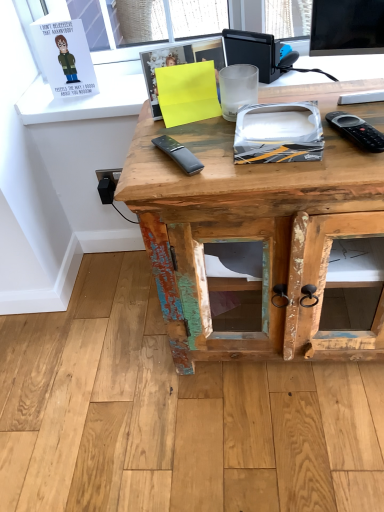
Question: Is rustic wood desk at center to the left of matte paper card at upper left, acting as the second book starting from the front, from the viewer's perspective?

Choices:
 (A) no
 (B) yes

Answer: (A)

Question: Is rustic wood desk at center not close to matte paper card at upper left, acting as the second book starting from the front?

Choices:
 (A) yes
 (B) no

Answer: (B)

Question: Would you say rustic wood desk at center is outside matte paper card at upper left, which is counted as the 1th book, starting from the top?

Choices:
 (A) no
 (B) yes

Answer: (B)

Question: Considering the relative sizes of rustic wood desk at center and matte paper card at upper left, the 1th book from the left, in the image provided, is rustic wood desk at center smaller than matte paper card at upper left, the 1th book from the left,?

Choices:
 (A) yes
 (B) no

Answer: (B)

Question: Is rustic wood desk at center beside matte paper card at upper left, which is counted as the 1th book, starting from the top?

Choices:
 (A) no
 (B) yes

Answer: (A)

Question: Is rustic wood desk at center shorter than matte paper card at upper left, the 1th book from the left?

Choices:
 (A) no
 (B) yes

Answer: (A)

Question: Does rustic wood desk at center have a greater height compared to yellow paper at center, the second book viewed from the left?

Choices:
 (A) yes
 (B) no

Answer: (A)

Question: Considering the relative sizes of rustic wood desk at center and yellow paper at center, positioned as the second book in top-to-bottom order, in the image provided, is rustic wood desk at center smaller than yellow paper at center, positioned as the second book in top-to-bottom order,?

Choices:
 (A) no
 (B) yes

Answer: (A)

Question: Can you confirm if rustic wood desk at center is positioned to the left of yellow paper at center, which ranks as the 1th book in right-to-left order?

Choices:
 (A) no
 (B) yes

Answer: (A)

Question: Does rustic wood desk at center come behind yellow paper at center, the 1th book viewed from the front?

Choices:
 (A) yes
 (B) no

Answer: (B)

Question: Is rustic wood desk at center next to yellow paper at center, the 1th book viewed from the front, and touching it?

Choices:
 (A) no
 (B) yes

Answer: (A)

Question: Is yellow paper at center, arranged as the second book when viewed from the back, at the back of rustic wood desk at center?

Choices:
 (A) yes
 (B) no

Answer: (B)

Question: Can you confirm if yellow paper at center, the 1th book viewed from the front, is wider than matte paper card at upper left, placed as the second book when sorted from right to left?

Choices:
 (A) yes
 (B) no

Answer: (B)